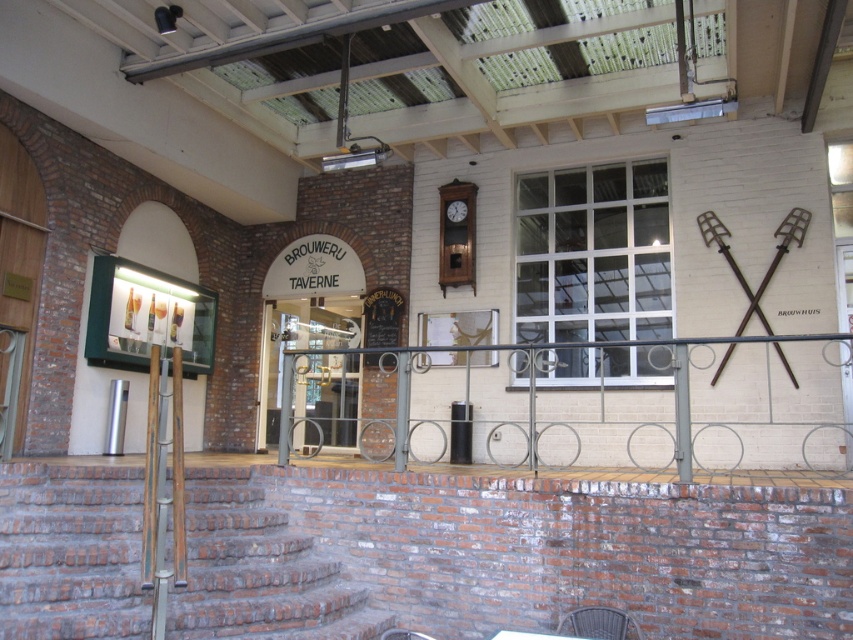
Question: Among these objects, which one is farthest from the camera?

Choices:
 (A) wooden table at lower center
 (B) clear glass window at center
 (C) metallic gray railing at center
 (D) brick stairs at lower center

Answer: (B)

Question: Can you confirm if metallic gray railing at center is positioned below rattan chair at lower center?

Choices:
 (A) yes
 (B) no

Answer: (B)

Question: Considering the relative positions of brick stairs at lower center and wooden clock at center in the image provided, where is brick stairs at lower center located with respect to wooden clock at center?

Choices:
 (A) above
 (B) below

Answer: (B)

Question: Which is farther from the wooden clock at center?

Choices:
 (A) wooden table at lower center
 (B) rattan chair at lower center
 (C) brick stairs at lower center
 (D) clear glass window at center

Answer: (B)

Question: Which of the following is the farthest from the observer?

Choices:
 (A) (412, 352)
 (B) (561, 636)
 (C) (460, 198)
 (D) (593, 176)

Answer: (C)

Question: Can you confirm if wooden clock at center is positioned above rattan chair at lower center?

Choices:
 (A) no
 (B) yes

Answer: (B)